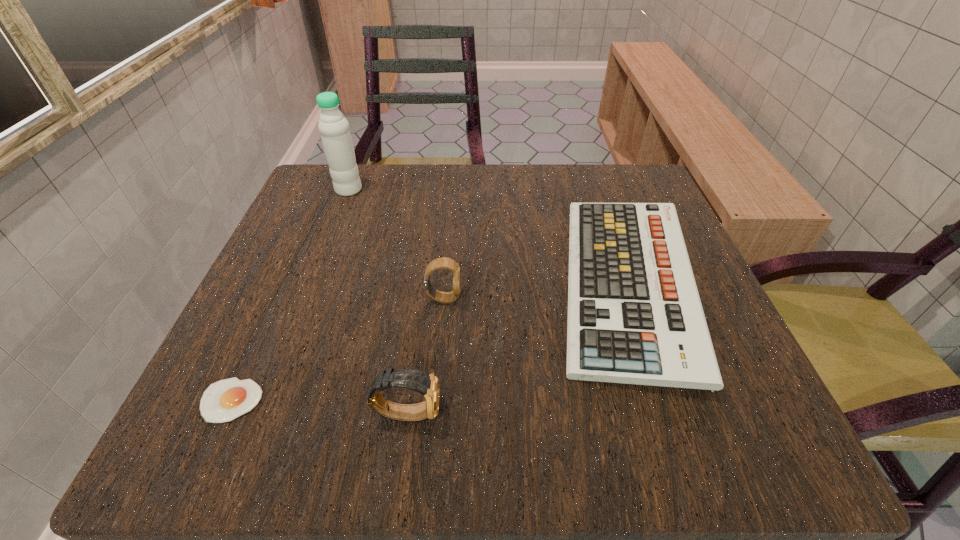
Identify the location of vacant space in between the computer keyboard and the farther watch. Image resolution: width=960 pixels, height=540 pixels. (536, 291).

Where is `vacant region between the egg yolk and the farthest object`? Image resolution: width=960 pixels, height=540 pixels. vacant region between the egg yolk and the farthest object is located at coordinates (290, 295).

Choose which object is the second nearest neighbor to the farthest object. Please provide its 2D coordinates. Your answer should be formatted as a tuple, i.e. [(x, y)], where the tuple contains the x and y coordinates of a point satisfying the conditions above.

[(634, 313)]

Identify which object is the nearest to the tallest object. Please provide its 2D coordinates. Your answer should be formatted as a tuple, i.e. [(x, y)], where the tuple contains the x and y coordinates of a point satisfying the conditions above.

[(446, 263)]

Where is `free location that satisfies the following two spatial constraints: 1. on the front side of the second shortest object; 2. on the face of the farther watch`? The width and height of the screenshot is (960, 540). free location that satisfies the following two spatial constraints: 1. on the front side of the second shortest object; 2. on the face of the farther watch is located at coordinates (632, 299).